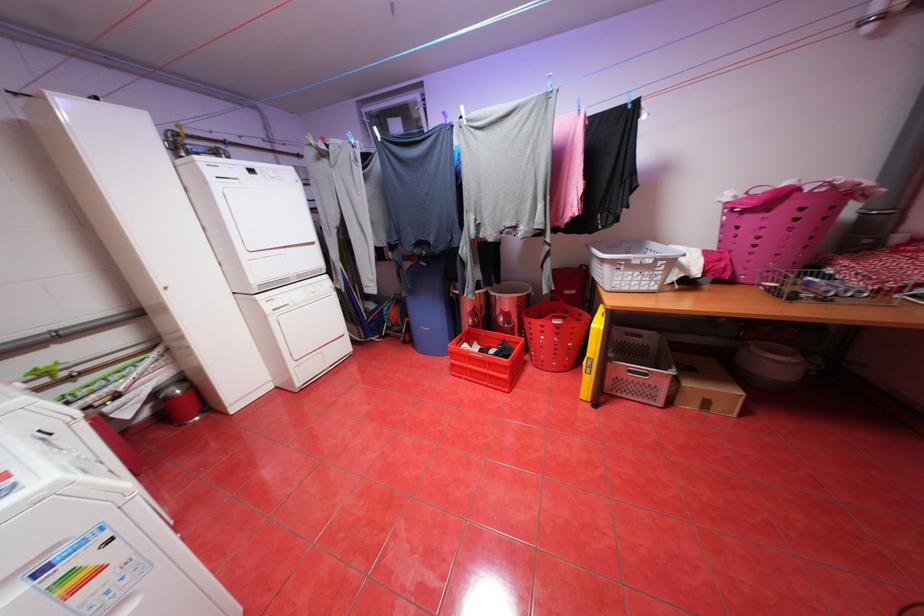
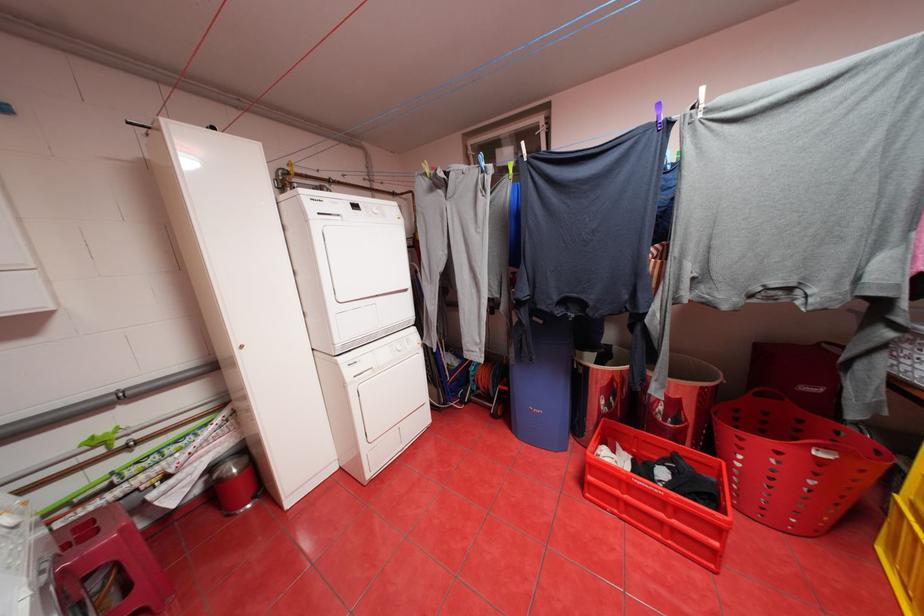
Locate, in the second image, the point that corresponds to [488,344] in the first image.

(631, 448)